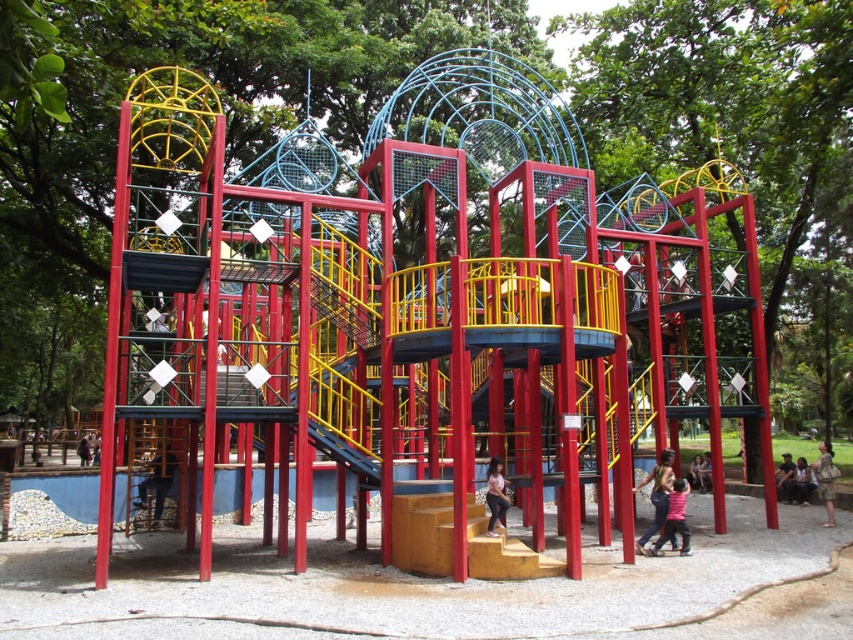
Question: Among these objects, which one is farthest from the camera?

Choices:
 (A) matte pink shirt at center
 (B) pink fabric dress at center
 (C) matte black shirt at lower left
 (D) pink matte shirt at center

Answer: (B)

Question: Which object appears closest to the camera in this image?

Choices:
 (A) pink fabric dress at center
 (B) camouflage fabric shirt at lower right
 (C) pink matte shirt at center

Answer: (C)

Question: Is matte black shirt at lower left smaller than dark blue fabric shirt at lower right?

Choices:
 (A) no
 (B) yes

Answer: (A)

Question: Is matte black shirt at lower left below pink matte shirt at center?

Choices:
 (A) no
 (B) yes

Answer: (B)

Question: Which object is closer to the camera taking this photo?

Choices:
 (A) camouflage fabric shirt at lower right
 (B) pink matte shirt at center

Answer: (B)

Question: Can you confirm if dark blue fabric shirt at lower right is thinner than pink fabric dress at center?

Choices:
 (A) no
 (B) yes

Answer: (B)